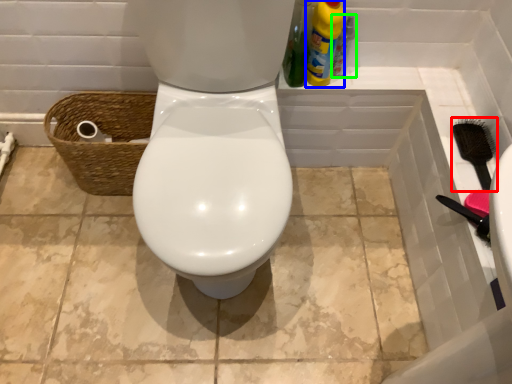
Question: Estimate the real-world distances between objects in this image. Which object is closer to brush (highlighted by a red box), cleaning product (highlighted by a blue box) or bottle (highlighted by a green box)?

Choices:
 (A) cleaning product
 (B) bottle

Answer: (B)